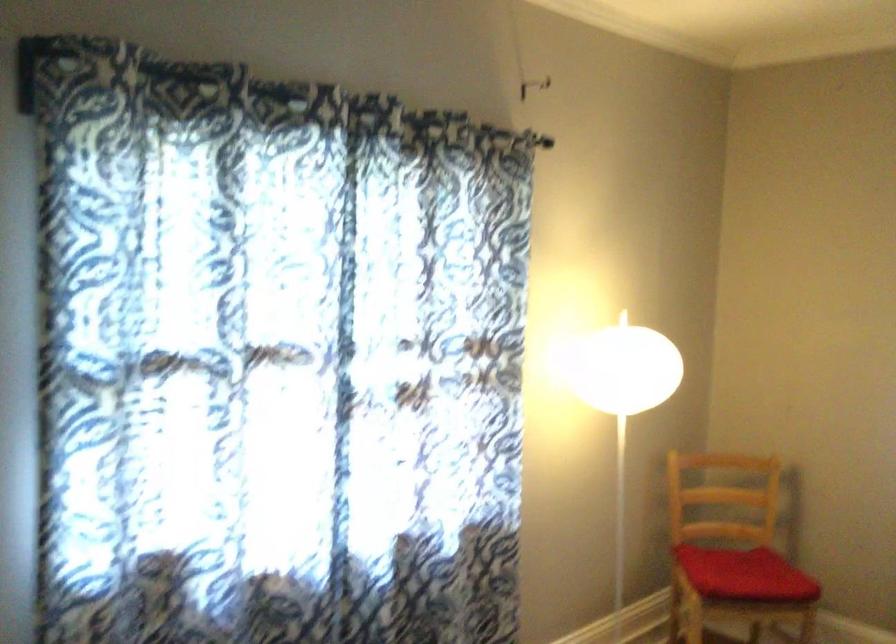
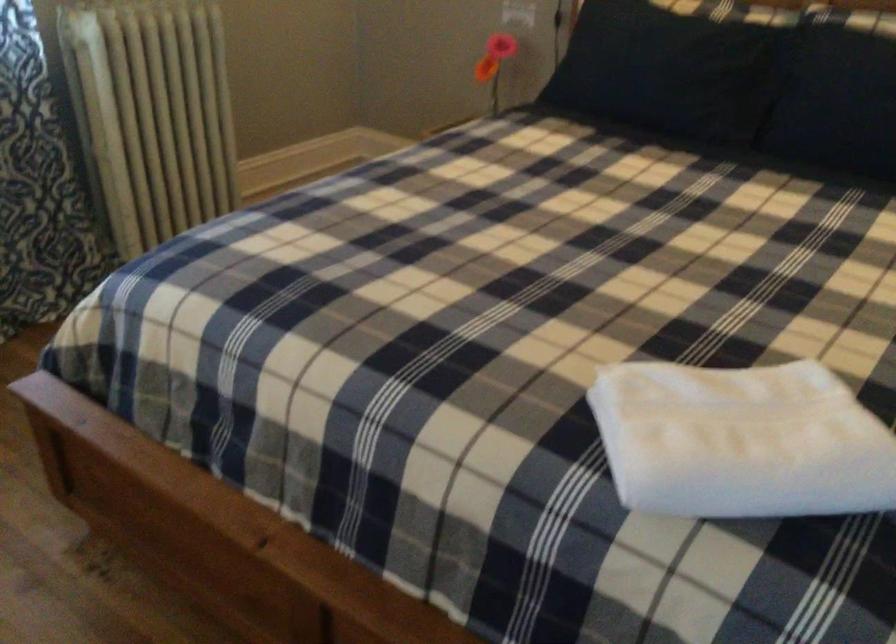
How did the camera likely rotate?

The camera rotated toward right-down.